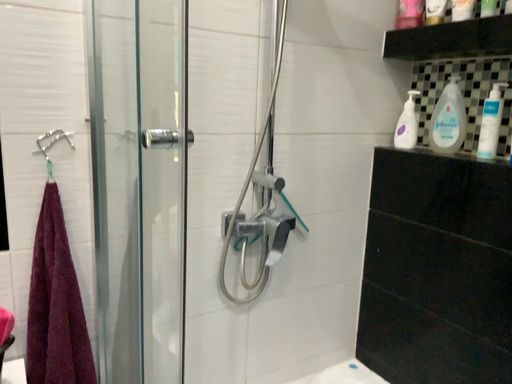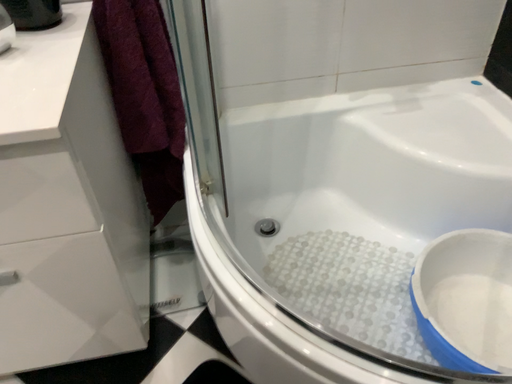
Question: Which way did the camera rotate in the video?

Choices:
 (A) rotated left
 (B) rotated right

Answer: (A)